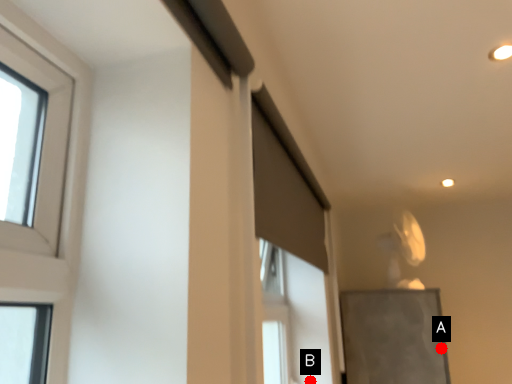
Question: Two points are circled on the image, labeled by A and B beside each circle. Which point is closer to the camera?

Choices:
 (A) A is closer
 (B) B is closer

Answer: (B)